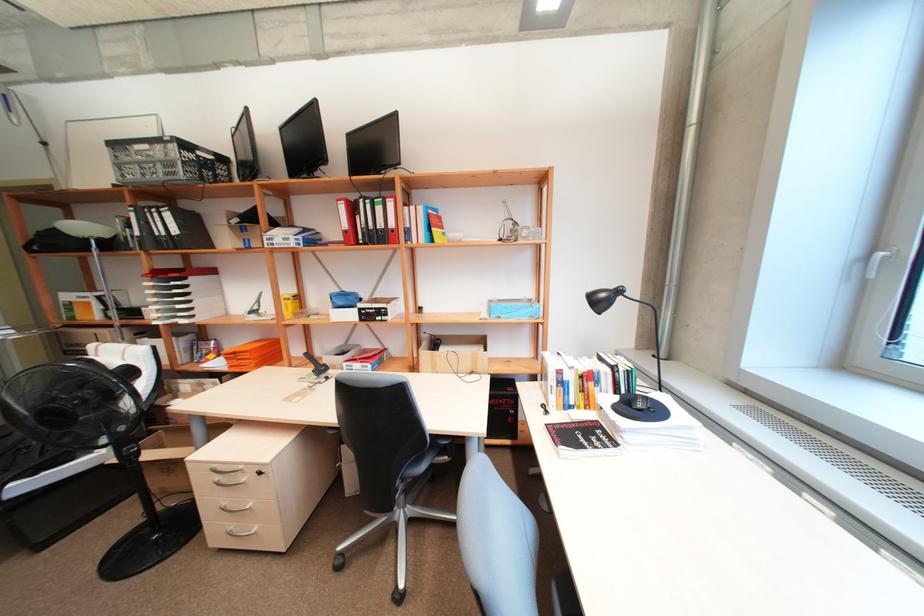
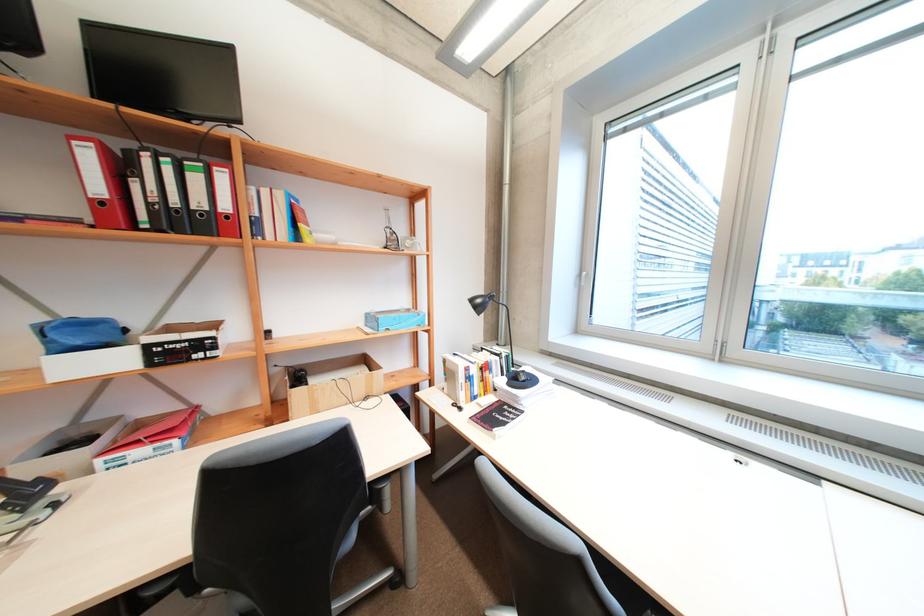
Question: How did the camera likely rotate?

Choices:
 (A) Left
 (B) Right
 (C) Up
 (D) Down

Answer: (B)